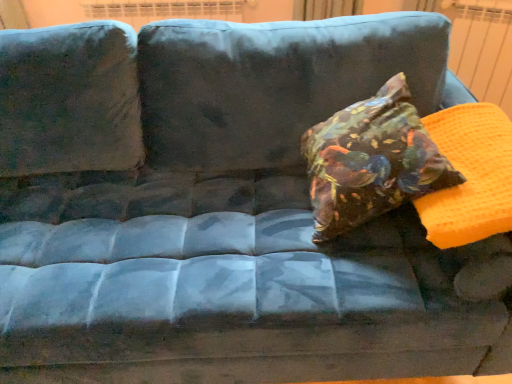
Question: Considering the positions of floral fabric pillow at center and orange waffle-patterned radiator at upper right in the image, is floral fabric pillow at center bigger or smaller than orange waffle-patterned radiator at upper right?

Choices:
 (A) small
 (B) big

Answer: (B)

Question: From the image's perspective, is floral fabric pillow at center positioned above or below orange waffle-patterned radiator at upper right?

Choices:
 (A) below
 (B) above

Answer: (A)

Question: Is floral fabric pillow at center wider or thinner than orange waffle-patterned radiator at upper right?

Choices:
 (A) thin
 (B) wide

Answer: (B)

Question: From a real-world perspective, is orange waffle-patterned radiator at upper right positioned above or below floral fabric pillow at center?

Choices:
 (A) above
 (B) below

Answer: (B)

Question: Considering the positions of orange waffle-patterned radiator at upper right and floral fabric pillow at center in the image, is orange waffle-patterned radiator at upper right wider or thinner than floral fabric pillow at center?

Choices:
 (A) wide
 (B) thin

Answer: (B)

Question: Is orange waffle-patterned radiator at upper right to the left or to the right of floral fabric pillow at center in the image?

Choices:
 (A) left
 (B) right

Answer: (B)

Question: From their relative heights in the image, would you say orange waffle-patterned radiator at upper right is taller or shorter than floral fabric pillow at center?

Choices:
 (A) tall
 (B) short

Answer: (A)